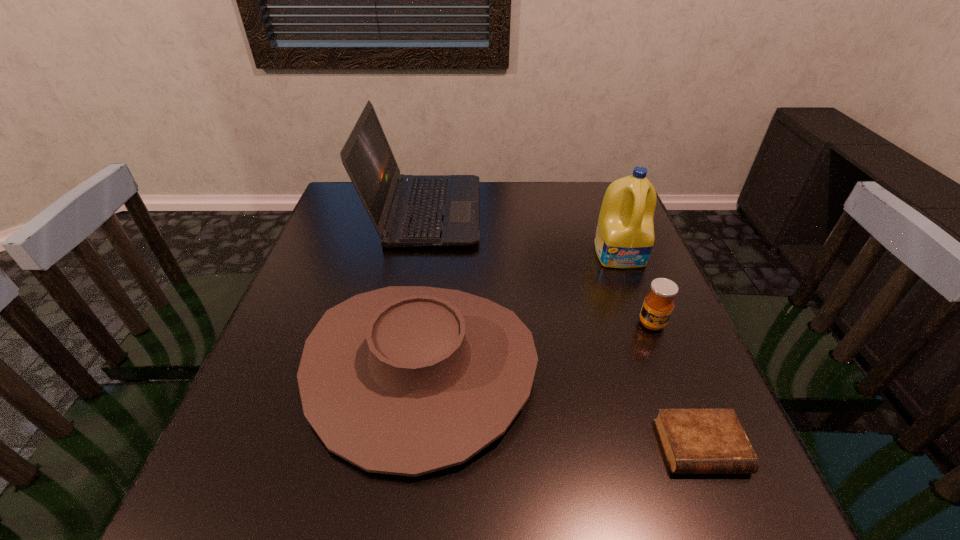
At what (x,y) coordinates should I click in order to perform the action: click on object located at the far edge. Please return your answer as a coordinate pair (x, y). Looking at the image, I should click on (406, 210).

Where is `cowboy hat located at the near edge`? This screenshot has height=540, width=960. cowboy hat located at the near edge is located at coordinates (404, 380).

At what (x,y) coordinates should I click in order to perform the action: click on diary at the near edge. Please return your answer as a coordinate pair (x, y). The width and height of the screenshot is (960, 540). Looking at the image, I should click on (695, 441).

Find the location of a particular element. laptop_computer that is at the left edge is located at coordinates (406, 210).

Locate an element on the screen. cowboy hat located in the left edge section of the desktop is located at coordinates click(404, 380).

At what (x,y) coordinates should I click in order to perform the action: click on detergent located in the right edge section of the desktop. Please return your answer as a coordinate pair (x, y). This screenshot has width=960, height=540. Looking at the image, I should click on (624, 238).

Where is `honey that is at the right edge`? The height and width of the screenshot is (540, 960). honey that is at the right edge is located at coordinates (658, 304).

What are the coordinates of `diary that is positioned at the right edge` in the screenshot? It's located at (695, 441).

Where is `object located in the far left corner section of the desktop`? object located in the far left corner section of the desktop is located at coordinates (406, 210).

Where is `object that is at the near left corner`? object that is at the near left corner is located at coordinates (404, 380).